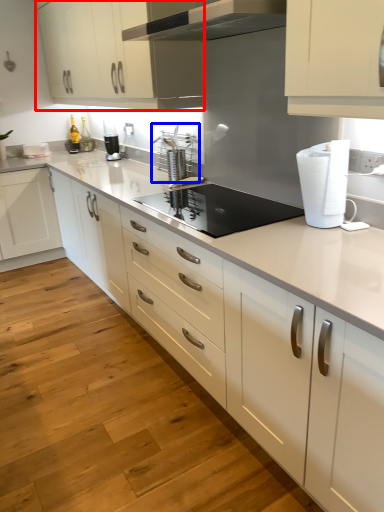
Question: Which object appears farthest to the camera in this image, cabinetry (highlighted by a red box) or appliance (highlighted by a blue box)?

Choices:
 (A) cabinetry
 (B) appliance

Answer: (B)